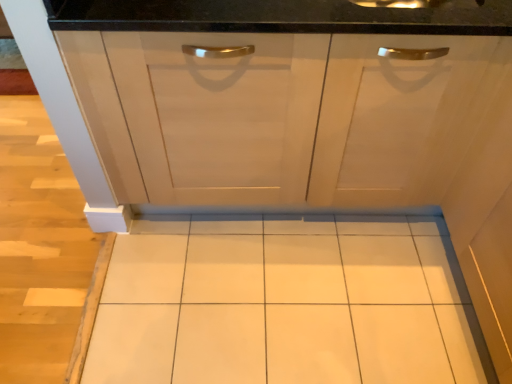
Where is `vacant space in front of matte white cabinet at center`? The width and height of the screenshot is (512, 384). vacant space in front of matte white cabinet at center is located at coordinates (265, 298).